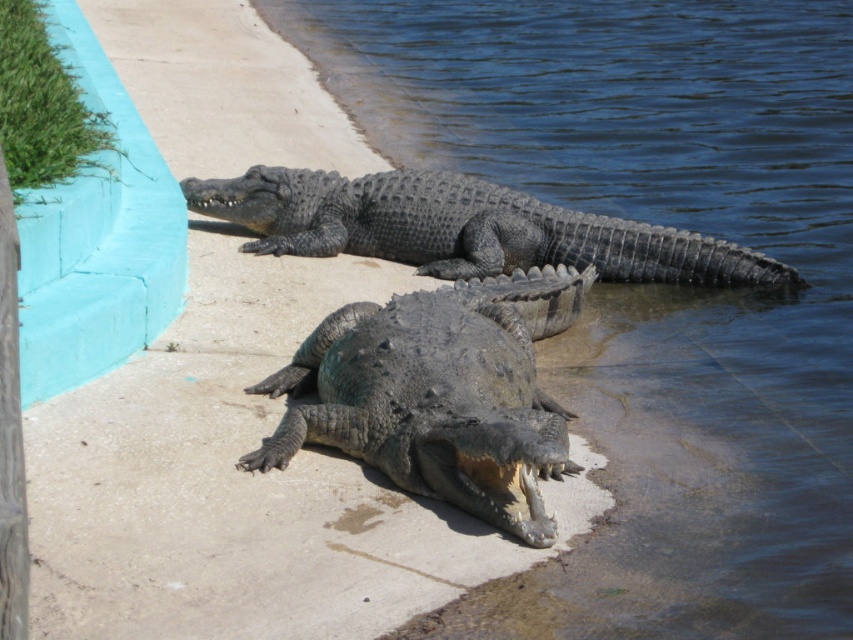
Which is below, clear blue water at center or shiny dark green crocodile at center?

Positioned lower is shiny dark green crocodile at center.

Is point (804, 326) more distant than point (329, 360)?

Yes, it is behind point (329, 360).

Find the location of `clear blue water at center`. clear blue water at center is located at coordinates (x=654, y=285).

Is clear blue water at center thinner than shiny dark gray crocodile at upper center?

Incorrect, clear blue water at center's width is not less than shiny dark gray crocodile at upper center's.

Does clear blue water at center have a smaller size compared to shiny dark gray crocodile at upper center?

Incorrect, clear blue water at center is not smaller in size than shiny dark gray crocodile at upper center.

Is point (596, 621) farther from viewer compared to point (717, 241)?

No.

Identify the location of clear blue water at center. (654, 285).

Is shiny dark green crocodile at center shorter than shiny dark gray crocodile at upper center?

No, shiny dark green crocodile at center is not shorter than shiny dark gray crocodile at upper center.

Between shiny dark green crocodile at center and shiny dark gray crocodile at upper center, which one appears on the right side from the viewer's perspective?

Positioned to the right is shiny dark gray crocodile at upper center.

Who is more forward, (363,417) or (283,198)?

Positioned in front is point (363,417).

This screenshot has width=853, height=640. Identify the location of shiny dark green crocodile at center. (437, 390).